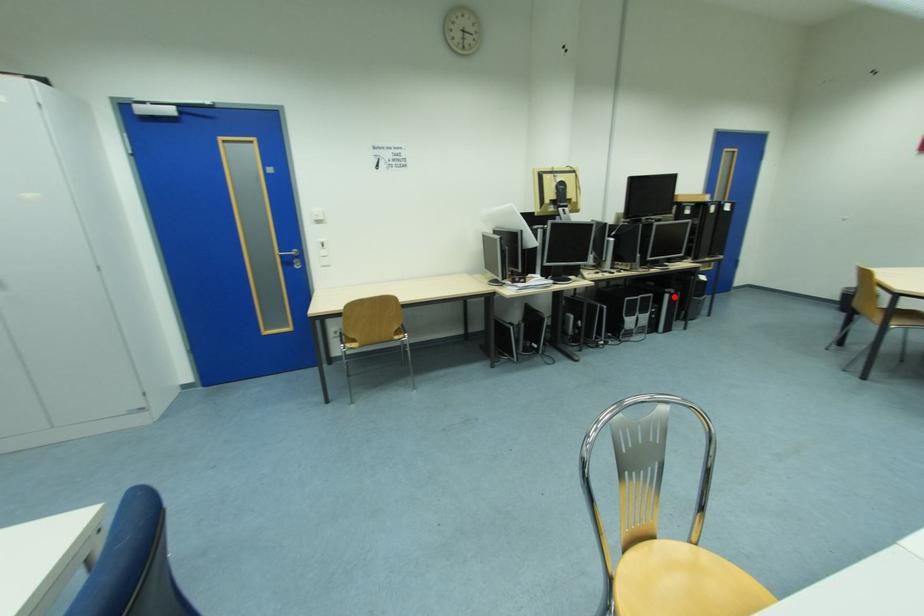
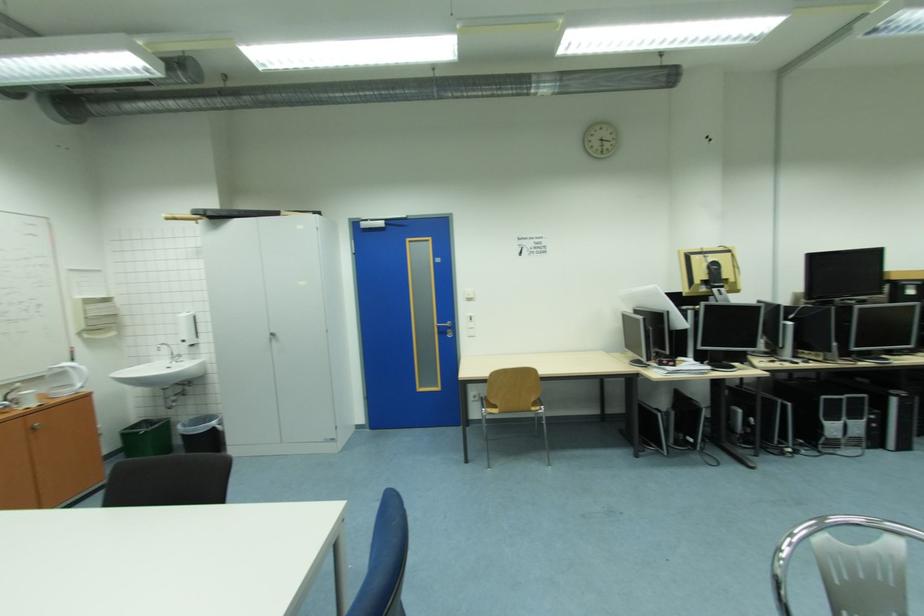
Question: I am providing you with two images of the same scene from different viewpoints. Image1 has a red point marked. In image2, the corresponding 3D location appears at what relative position? Reply with the corresponding letter.

Choices:
 (A) Closer
 (B) Farther

Answer: (A)